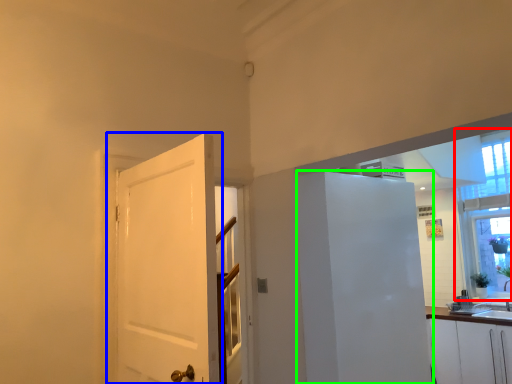
Question: Which object is the closest to the window (highlighted by a red box)? Choose among these: door (highlighted by a blue box) or elevator (highlighted by a green box).

Choices:
 (A) door
 (B) elevator

Answer: (B)